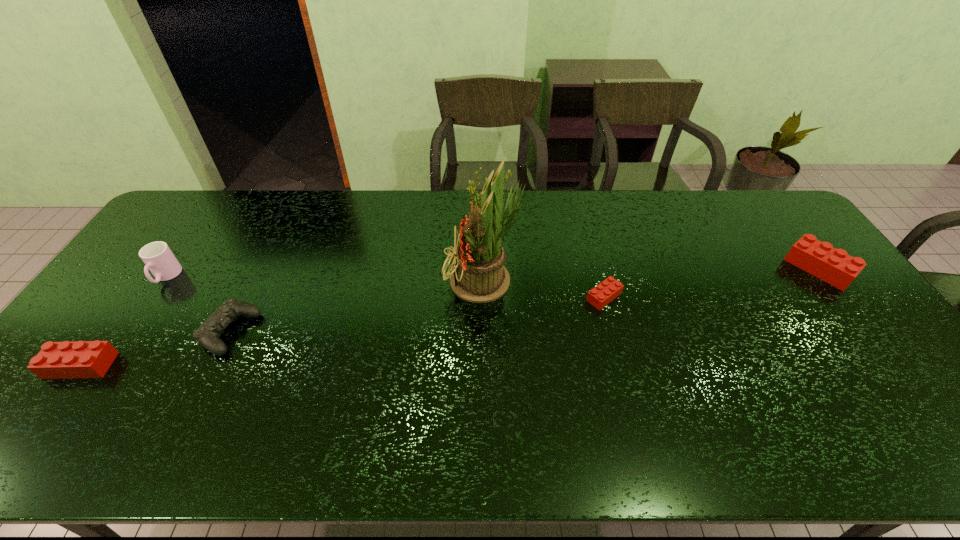
This screenshot has height=540, width=960. I want to click on vacant area situated on the front of the fifth object from left to right, so click(x=624, y=375).

At what (x,y) coordinates should I click in order to perform the action: click on vacant area situated 0.210m on the back of the rightmost object. Please return your answer as a coordinate pair (x, y). This screenshot has width=960, height=540. Looking at the image, I should click on (773, 208).

At what (x,y) coordinates should I click in order to perform the action: click on vacant space located 0.280m in front of the flower arrangement with the fan visible. Please return your answer as a coordinate pair (x, y). This screenshot has height=540, width=960. Looking at the image, I should click on (351, 281).

In order to click on vacant space situated in front of the flower arrangement with the fan visible in this screenshot , I will do pos(424,281).

I want to click on vacant space located in front of the flower arrangement with the fan visible, so click(x=351, y=281).

Image resolution: width=960 pixels, height=540 pixels. Identify the location of vacant space situated 0.050m on the right of the fourth object from right to left. (274, 333).

Identify the location of vacant space located with the handle on the side of the cup. This screenshot has height=540, width=960. (148, 303).

Find the location of a particular element. Lego that is at the left edge is located at coordinates (83, 359).

This screenshot has width=960, height=540. Find the location of `cup that is positioned at the left edge`. cup that is positioned at the left edge is located at coordinates (157, 256).

Where is `object that is positioned at the right edge`? The width and height of the screenshot is (960, 540). object that is positioned at the right edge is located at coordinates (834, 266).